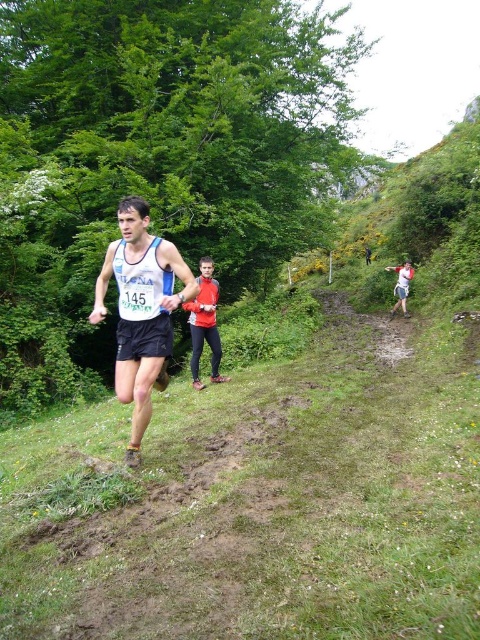
Describe the element at coordinates (141, 308) in the screenshot. I see `matte blue tank top at center` at that location.

Between matte blue tank top at center and red fabric jacket at center, which one has more height?

matte blue tank top at center is taller.

Identify the location of matte blue tank top at center. This screenshot has width=480, height=640. (141, 308).

Is red fabric jacket at center to the left of white cotton shirt at right from the viewer's perspective?

Indeed, red fabric jacket at center is positioned on the left side of white cotton shirt at right.

Which is below, red fabric jacket at center or white cotton shirt at right?

red fabric jacket at center is lower down.

Which is behind, point (192, 307) or point (397, 305)?

The point (397, 305) is more distant.

Where is `red fabric jacket at center`? red fabric jacket at center is located at coordinates (204, 323).

Is matte blue tank top at center to the left of white cotton shirt at right from the viewer's perspective?

Correct, you'll find matte blue tank top at center to the left of white cotton shirt at right.

Which of these two, matte blue tank top at center or white cotton shirt at right, stands taller?

matte blue tank top at center

Does point (132, 230) come behind point (397, 273)?

No, (132, 230) is closer to viewer.

You are a GUI agent. You are given a task and a screenshot of the screen. Output one action in this format:
    pyautogui.click(x=<x>, y=<y>)
    Task: Click on the matte blue tank top at center
    This screenshot has width=480, height=640.
    Given the screenshot: What is the action you would take?
    pyautogui.click(x=141, y=308)